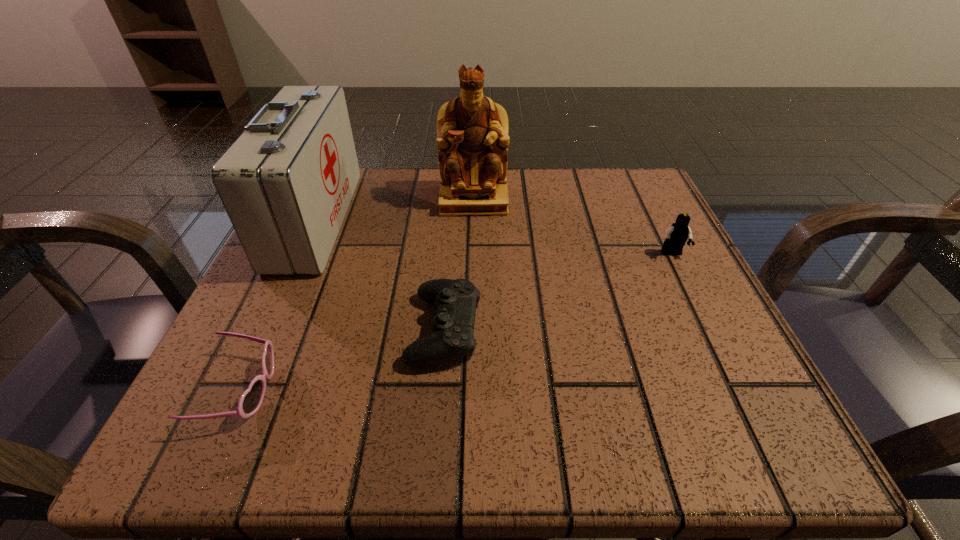
At what (x,y) coordinates should I click in order to perform the action: click on the tallest object. Please return your answer as a coordinate pair (x, y). The width and height of the screenshot is (960, 540). Looking at the image, I should click on (472, 138).

This screenshot has width=960, height=540. I want to click on the second tallest object, so click(286, 183).

Where is `the rightmost object`? The width and height of the screenshot is (960, 540). the rightmost object is located at coordinates (676, 236).

Identify the location of Lego. This screenshot has width=960, height=540. (676, 236).

Locate an element on the screen. This screenshot has width=960, height=540. control is located at coordinates (452, 328).

Identify the location of the shortest object. (251, 400).

At what (x,y) coordinates should I click in order to perform the action: click on vacant area located on the front-facing side of the figurine. Please return your answer as a coordinate pair (x, y). Image resolution: width=960 pixels, height=540 pixels. Looking at the image, I should click on (471, 295).

At what (x,y) coordinates should I click in order to perform the action: click on vacant space located 0.120m on the front-facing side of the first-aid kit. Please return your answer as a coordinate pair (x, y). The height and width of the screenshot is (540, 960). Looking at the image, I should click on (404, 220).

Find the location of `vacant space situated 0.150m on the front-facing side of the Lego`. vacant space situated 0.150m on the front-facing side of the Lego is located at coordinates (706, 323).

I want to click on vacant position located on the back of the second shortest object, so click(x=452, y=227).